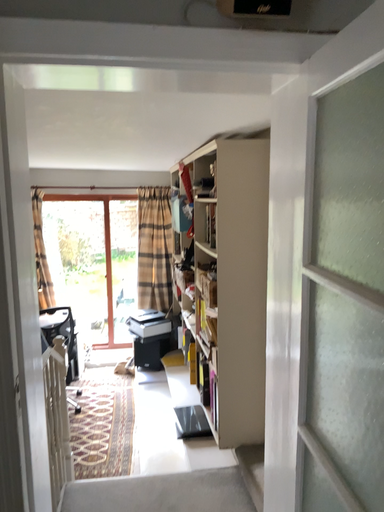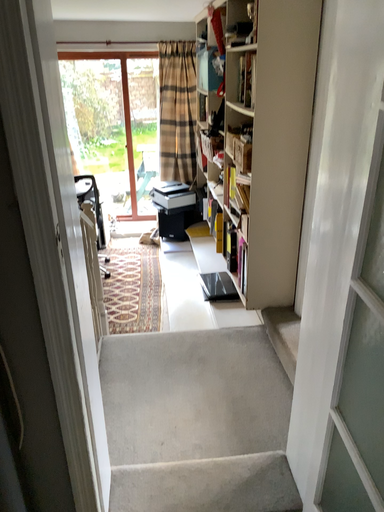
Question: Which way did the camera rotate in the video?

Choices:
 (A) rotated downward
 (B) rotated upward

Answer: (A)